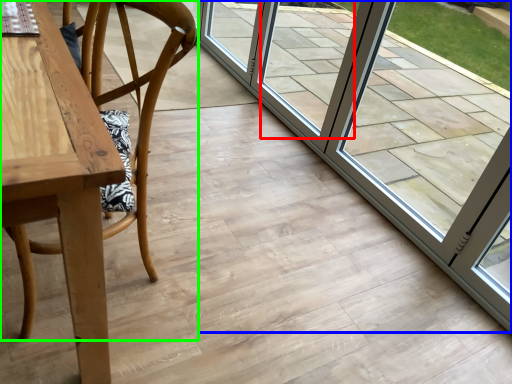
Question: Which object is the farthest from window (highlighted by a red box)? Choose among these: door (highlighted by a blue box) or chair (highlighted by a green box).

Choices:
 (A) door
 (B) chair

Answer: (B)